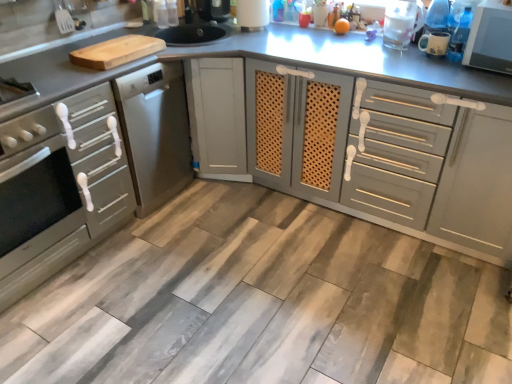
At what (x,y) coordinates should I click in order to perform the action: click on vacant position to the left of matte white mug at upper right, which is counted as the 1th appliance, starting from the right. Please return your answer as a coordinate pair (x, y). Image resolution: width=512 pixels, height=384 pixels. Looking at the image, I should click on [395, 59].